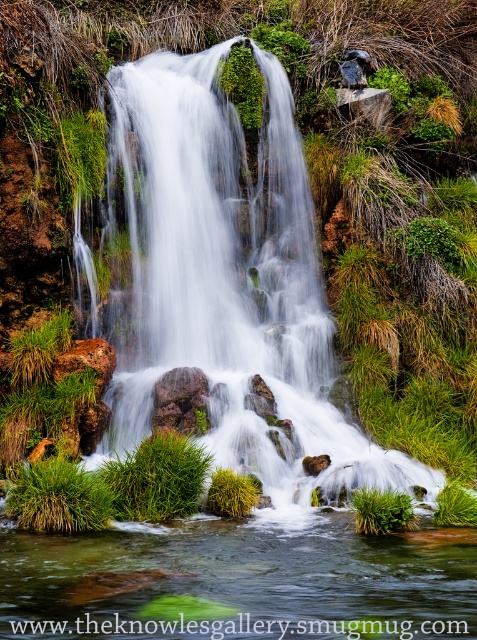
Question: Is white smooth waterfall at center above green grass at lower center?

Choices:
 (A) yes
 (B) no

Answer: (A)

Question: Which of these objects is positioned closest to the rusty rock at center?

Choices:
 (A) green grassy stream at center
 (B) white smooth waterfall at center

Answer: (B)

Question: Which point is closer to the camera?

Choices:
 (A) (318, 620)
 (B) (284, 76)
 (C) (394, 502)

Answer: (A)

Question: Observing the image, what is the correct spatial positioning of white smooth waterfall at center in reference to green grass at lower center?

Choices:
 (A) left
 (B) right

Answer: (A)

Question: Can you confirm if white smooth waterfall at center is bigger than green grassy stream at center?

Choices:
 (A) yes
 (B) no

Answer: (A)

Question: Estimate the real-world distances between objects in this image. Which object is farther from the green grassy stream at center?

Choices:
 (A) rusty rock at center
 (B) green grass at lower center

Answer: (A)